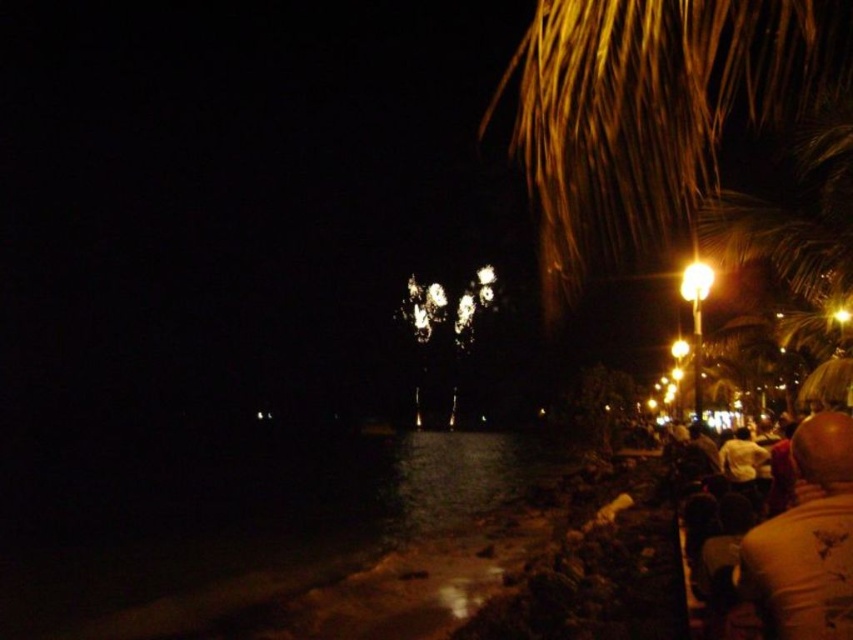
Is brown textured palm tree at upper right smaller than white t-shirt at lower right?

No.

Where is `brown textured palm tree at upper right`? The width and height of the screenshot is (853, 640). brown textured palm tree at upper right is located at coordinates (653, 109).

The image size is (853, 640). Describe the element at coordinates (805, 540) in the screenshot. I see `white t-shirt at lower right` at that location.

Can you confirm if white t-shirt at lower right is positioned to the left of white cotton shirt at lower right?

Correct, you'll find white t-shirt at lower right to the left of white cotton shirt at lower right.

Does point (808, 493) come farther from viewer compared to point (735, 448)?

No, it is in front of (735, 448).

The height and width of the screenshot is (640, 853). Identify the location of white t-shirt at lower right. (805, 540).

Locate an element on the screen. The image size is (853, 640). brown textured palm tree at upper right is located at coordinates coord(653,109).

How distant is brown textured palm tree at upper right from white cotton shirt at lower right?

The distance of brown textured palm tree at upper right from white cotton shirt at lower right is 110.49 feet.

The width and height of the screenshot is (853, 640). What do you see at coordinates (653, 109) in the screenshot? I see `brown textured palm tree at upper right` at bounding box center [653, 109].

Locate an element on the screen. This screenshot has width=853, height=640. brown textured palm tree at upper right is located at coordinates (653, 109).